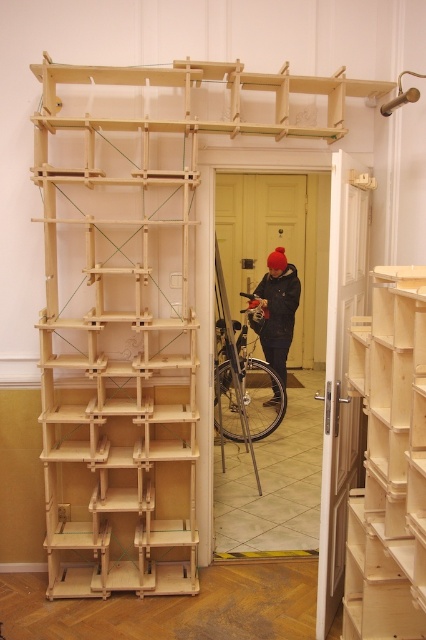
Who is lower down, dark blue jacket at center or black matte jacket at center?

Positioned lower is dark blue jacket at center.

Does dark blue jacket at center have a smaller size compared to black matte jacket at center?

No, dark blue jacket at center is not smaller than black matte jacket at center.

Which is in front, point (294, 308) or point (267, 323)?

Point (294, 308)

The width and height of the screenshot is (426, 640). I want to click on dark blue jacket at center, so coord(278,310).

Looking at this image, does pine wood shelves at right come in front of black matte jacket at center?

Yes.

Which is behind, point (388, 604) or point (270, 300)?

The point (270, 300) is behind.

Looking at this image, measure the distance between pine wood shelves at right and camera.

5.17 feet

Identify the location of pine wood shelves at right. (388, 464).

Is dark blue jacket at center further to the viewer compared to black rubber tire at center?

Yes, it is.

Is dark blue jacket at center bigger than black rubber tire at center?

No, dark blue jacket at center is not bigger than black rubber tire at center.

Locate an element on the screen. This screenshot has width=426, height=640. dark blue jacket at center is located at coordinates (278, 310).